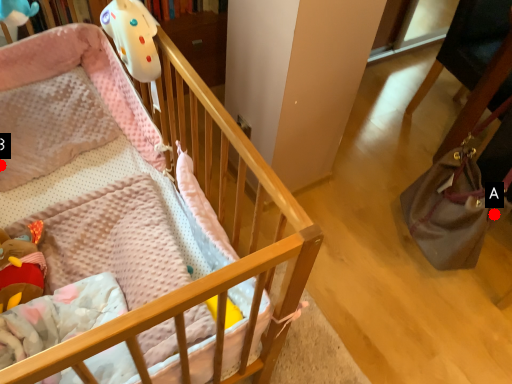
Question: Two points are circled on the image, labeled by A and B beside each circle. Which point is closer to the camera taking this photo?

Choices:
 (A) A is closer
 (B) B is closer

Answer: (B)